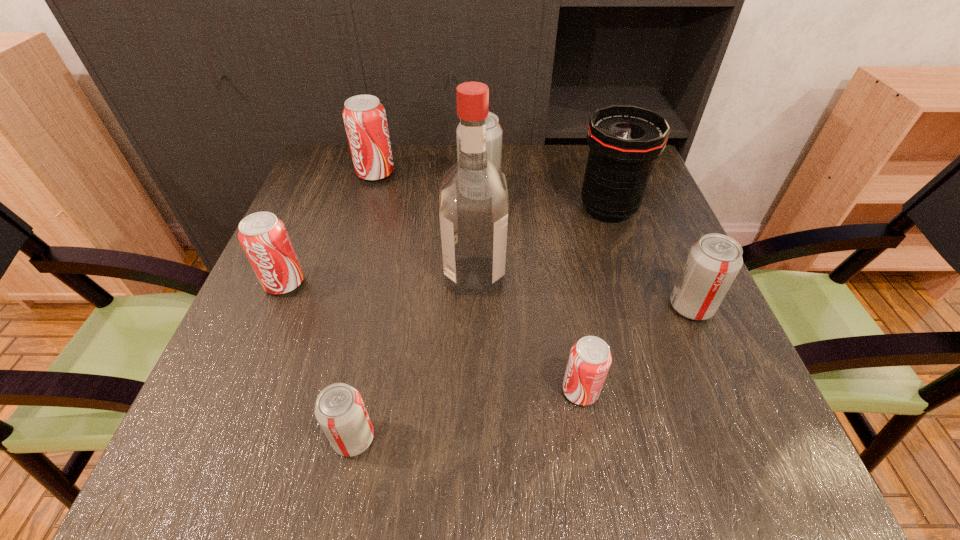
Where is `vacant space in between the biggest red soda can and the second nearest gray soda can`? vacant space in between the biggest red soda can and the second nearest gray soda can is located at coordinates (533, 240).

In order to click on free space that is in between the second soda can from right to left and the liquor in this screenshot , I will do `click(528, 333)`.

In order to click on vacant area between the rightmost red soda can and the second gray soda can from right to left in this screenshot , I will do `click(530, 292)`.

At what (x,y) coordinates should I click in order to perform the action: click on free space between the nearest gray soda can and the rightmost soda can. Please return your answer as a coordinate pair (x, y). The image size is (960, 540). Looking at the image, I should click on (522, 373).

This screenshot has height=540, width=960. I want to click on free space between the second smallest gray soda can and the telephoto lens, so click(650, 258).

You are a GUI agent. You are given a task and a screenshot of the screen. Output one action in this format:
    pyautogui.click(x=<x>, y=<y>)
    Task: Click on the closest object relative to the rightmost gray soda can
    This screenshot has height=540, width=960.
    Given the screenshot: What is the action you would take?
    pyautogui.click(x=624, y=141)

Locate which object is the sixth closest to the rightmost soda can. Please provide its 2D coordinates. Your answer should be formatted as a tuple, i.e. [(x, y)], where the tuple contains the x and y coordinates of a point satisfying the conditions above.

[(364, 117)]

Point out which soda can is positioned as the second nearest to the leftmost red soda can. Please provide its 2D coordinates. Your answer should be formatted as a tuple, i.e. [(x, y)], where the tuple contains the x and y coordinates of a point satisfying the conditions above.

[(364, 117)]

You are a GUI agent. You are given a task and a screenshot of the screen. Output one action in this format:
    pyautogui.click(x=<x>, y=<y>)
    Task: Click on the soda can that is the second nearest to the smallest gray soda can
    This screenshot has height=540, width=960.
    Given the screenshot: What is the action you would take?
    pyautogui.click(x=590, y=358)

Identify the location of the closest red soda can to the seventh object from right to left. (264, 238).